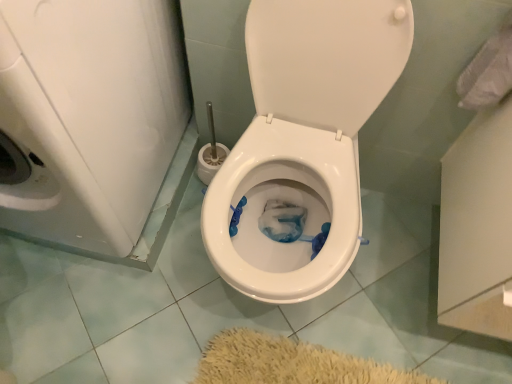
Question: Is white glossy washer at left turned away from white fabric at upper right?

Choices:
 (A) no
 (B) yes

Answer: (A)

Question: Are white glossy washer at left and white fabric at upper right far apart?

Choices:
 (A) no
 (B) yes

Answer: (A)

Question: Can you confirm if white glossy washer at left is thinner than white fabric at upper right?

Choices:
 (A) yes
 (B) no

Answer: (B)

Question: Can you confirm if white glossy washer at left is wider than white fabric at upper right?

Choices:
 (A) no
 (B) yes

Answer: (B)

Question: Can you confirm if white glossy washer at left is smaller than white fabric at upper right?

Choices:
 (A) no
 (B) yes

Answer: (A)

Question: Can we say white glossy washer at left lies outside white fabric at upper right?

Choices:
 (A) yes
 (B) no

Answer: (A)

Question: Considering the relative sizes of white fabric at upper right and white glossy washer at left in the image provided, is white fabric at upper right shorter than white glossy washer at left?

Choices:
 (A) yes
 (B) no

Answer: (A)

Question: From a real-world perspective, is white fabric at upper right positioned over white glossy washer at left based on gravity?

Choices:
 (A) yes
 (B) no

Answer: (A)

Question: Could you tell me if white fabric at upper right is facing white glossy washer at left?

Choices:
 (A) no
 (B) yes

Answer: (A)

Question: Would you say white fabric at upper right is outside white glossy washer at left?

Choices:
 (A) yes
 (B) no

Answer: (A)

Question: From the image's perspective, does white fabric at upper right appear lower than white glossy washer at left?

Choices:
 (A) yes
 (B) no

Answer: (B)

Question: Considering the relative sizes of white fabric at upper right and white glossy washer at left in the image provided, is white fabric at upper right thinner than white glossy washer at left?

Choices:
 (A) yes
 (B) no

Answer: (A)

Question: From a real-world perspective, is white fabric at upper right on top of white glossy toilet at center?

Choices:
 (A) yes
 (B) no

Answer: (A)